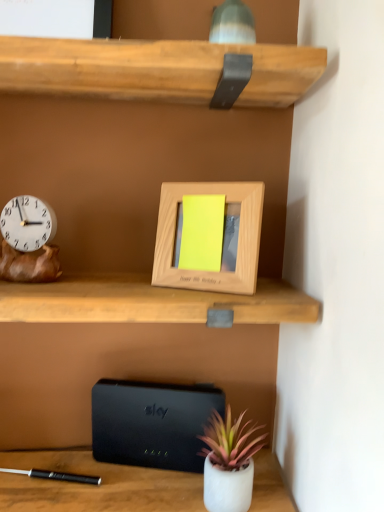
Measure the distance between point (140, 457) and camera.

The depth of point (140, 457) is 32.56 inches.

Identify the location of wooden clock at left. (27, 223).

Identify the location of wooden photo frame at center. The height and width of the screenshot is (512, 384). (238, 243).

Considering the relative sizes of wooden photo frame at center and matte white pot at lower center in the image provided, is wooden photo frame at center bigger than matte white pot at lower center?

Incorrect, wooden photo frame at center is not larger than matte white pot at lower center.

Where is `picture frame above the matte white pot at lower center (from a real-world perspective)`? picture frame above the matte white pot at lower center (from a real-world perspective) is located at coordinates (238, 243).

Can you confirm if wooden photo frame at center is thinner than matte white pot at lower center?

Correct, the width of wooden photo frame at center is less than that of matte white pot at lower center.

Can you tell me how much wooden photo frame at center and matte white pot at lower center differ in facing direction?

The angular difference between wooden photo frame at center and matte white pot at lower center is 1.33 degrees.

Is black matte/black plastic at lower center a part of wooden photo frame at center?

That's incorrect, black matte/black plastic at lower center is not inside wooden photo frame at center.

From a real-world perspective, which object rests below the other?

black matte/black plastic at lower center is physically lower.

Which object is more forward, wooden photo frame at center or black matte/black plastic at lower center?

wooden photo frame at center.

Considering the positions of points (219, 439) and (239, 236), is point (219, 439) closer to camera compared to point (239, 236)?

That is False.

Is matte white pot at lower center to the right of wooden photo frame at center from the viewer's perspective?

Correct, you'll find matte white pot at lower center to the right of wooden photo frame at center.

Where is `houseplant to the right of wooden photo frame at center`? houseplant to the right of wooden photo frame at center is located at coordinates (229, 463).

From their relative heights in the image, would you say matte white pot at lower center is taller or shorter than wooden photo frame at center?

In the image, matte white pot at lower center appears to be shorter than wooden photo frame at center.

From the image's perspective, is matte white pot at lower center above wooden clock at left?

No, from the image's perspective, matte white pot at lower center is not above wooden clock at left.

Is point (225, 439) positioned before point (42, 240)?

Yes, point (225, 439) is in front of point (42, 240).

Where is `houseplant directly beneath the wooden clock at left (from a real-world perspective)`? houseplant directly beneath the wooden clock at left (from a real-world perspective) is located at coordinates (229, 463).

In the scene shown: Is wooden clock at left far from black matte/black plastic at lower center?

No, there isn't a large distance between wooden clock at left and black matte/black plastic at lower center.

Is wooden clock at left looking in the opposite direction of black matte/black plastic at lower center?

wooden clock at left does not have its back to black matte/black plastic at lower center.

Who is more distant, wooden clock at left or black matte/black plastic at lower center?

black matte/black plastic at lower center is more distant.

Would you say wooden clock at left is outside black matte/black plastic at lower center?

wooden clock at left is positioned outside black matte/black plastic at lower center.

In terms of size, does wooden photo frame at center appear bigger or smaller than wooden clock at left?

wooden photo frame at center is bigger than wooden clock at left.

Could you tell me if wooden photo frame at center is facing wooden clock at left?

No, wooden photo frame at center is not turned towards wooden clock at left.

From the image's perspective, does wooden photo frame at center appear higher than wooden clock at left?

Yes, from the image's perspective, wooden photo frame at center is above wooden clock at left.

From a real-world perspective, who is located higher, wooden photo frame at center or wooden clock at left?

From a 3D spatial view, wooden photo frame at center is above.

Which object is more forward, wooden clock at left or wooden photo frame at center?

wooden photo frame at center is closer to the camera.

Is wooden clock at left oriented away from wooden photo frame at center?

No, wooden photo frame at center is not at the back of wooden clock at left.

Is wooden clock at left to the right of wooden photo frame at center from the viewer's perspective?

No, wooden clock at left is not to the right of wooden photo frame at center.

From a real-world perspective, is wooden clock at left above or below wooden photo frame at center?

From a real-world perspective, wooden clock at left is physically below wooden photo frame at center.

At what (x,y) coordinates should I click in order to perform the action: click on houseplant that appears behind the wooden photo frame at center. Please return your answer as a coordinate pair (x, y). Image resolution: width=384 pixels, height=512 pixels. Looking at the image, I should click on click(229, 463).

Identify the location of picture frame that appears on the right of black matte/black plastic at lower center. The image size is (384, 512). (238, 243).

Based on their spatial positions, is black matte/black plastic at lower center or matte white pot at lower center further from wooden clock at left?

matte white pot at lower center is further to wooden clock at left.

Based on their spatial positions, is matte white pot at lower center or wooden clock at left closer to wooden photo frame at center?

Based on the image, wooden clock at left appears to be nearer to wooden photo frame at center.

Looking at the image, which one is located further to matte white pot at lower center, wooden clock at left or black matte/black plastic at lower center?

wooden clock at left.

Based on their spatial positions, is matte white pot at lower center or wooden clock at left closer to black matte/black plastic at lower center?

Answer: Based on the image, matte white pot at lower center appears to be nearer to black matte/black plastic at lower center.

Based on their spatial positions, is wooden clock at left or matte white pot at lower center further from wooden photo frame at center?

matte white pot at lower center lies further to wooden photo frame at center than the other object.

Looking at the image, which one is located further to black matte/black plastic at lower center, matte white pot at lower center or wooden photo frame at center?

wooden photo frame at center lies further to black matte/black plastic at lower center than the other object.

Looking at this image, based on their spatial positions, is matte white pot at lower center or wooden photo frame at center further from wooden clock at left?

matte white pot at lower center lies further to wooden clock at left than the other object.

Based on their spatial positions, is wooden photo frame at center or matte white pot at lower center further from wooden clock at left?

matte white pot at lower center.

I want to click on paperback book between wooden photo frame at center and matte white pot at lower center in the up-down direction, so click(152, 423).

The width and height of the screenshot is (384, 512). Identify the location of clock between wooden photo frame at center and black matte/black plastic at lower center in the vertical direction. point(27,223).

I want to click on paperback book that lies between wooden clock at left and matte white pot at lower center from top to bottom, so click(x=152, y=423).

You are a GUI agent. You are given a task and a screenshot of the screen. Output one action in this format:
    pyautogui.click(x=<x>, y=<y>)
    Task: Click on the clock between wooden photo frame at center and matte white pot at lower center from top to bottom
    Image resolution: width=384 pixels, height=512 pixels.
    Given the screenshot: What is the action you would take?
    pyautogui.click(x=27, y=223)